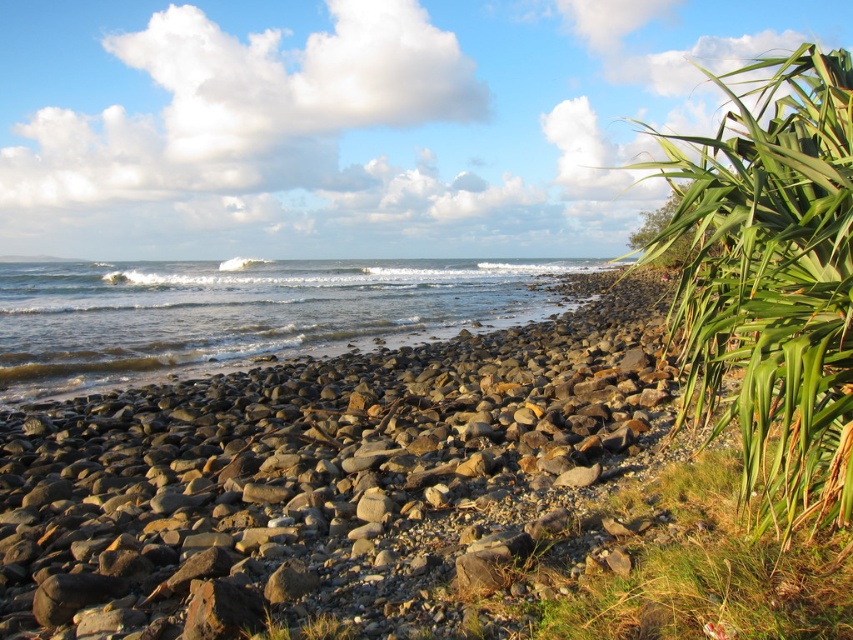
Question: Which point appears farthest from the camera in this image?

Choices:
 (A) (463, 317)
 (B) (337, 620)

Answer: (A)

Question: Which point is closer to the camera?

Choices:
 (A) green grass at lower center
 (B) clear water at center
 (C) green leafy plant at right

Answer: (C)

Question: Observing the image, what is the correct spatial positioning of green leafy plant at right in reference to green grass at lower center?

Choices:
 (A) below
 (B) above

Answer: (B)

Question: Can you confirm if green leafy plant at right is positioned to the left of clear water at center?

Choices:
 (A) no
 (B) yes

Answer: (A)

Question: Which object is farther from the camera taking this photo?

Choices:
 (A) clear water at center
 (B) green leafy plant at right

Answer: (A)

Question: Is green leafy plant at right wider than green grass at lower center?

Choices:
 (A) no
 (B) yes

Answer: (B)